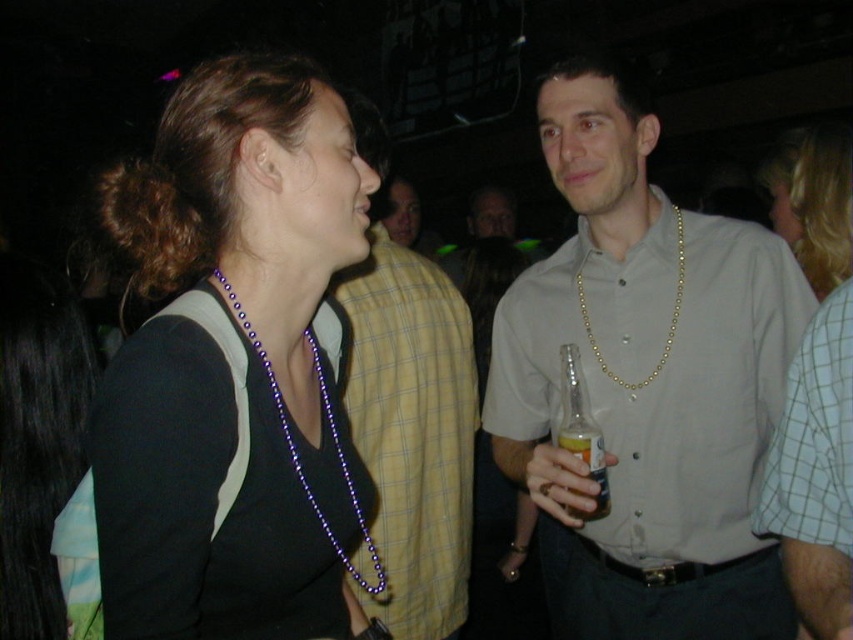
Does blonde hair at upper right have a greater height compared to clear glass bottle at right?

Answer: Yes.

Find the location of a particular element. The width and height of the screenshot is (853, 640). blonde hair at upper right is located at coordinates (811, 200).

Can you confirm if purple beaded necklace at upper left is wider than blonde hair at upper right?

Yes, purple beaded necklace at upper left is wider than blonde hair at upper right.

Who is positioned more to the right, purple beaded necklace at upper left or blonde hair at upper right?

From the viewer's perspective, blonde hair at upper right appears more on the right side.

Which is behind, point (364, 241) or point (798, 246)?

Positioned behind is point (798, 246).

Where is `purple beaded necklace at upper left`? The image size is (853, 640). purple beaded necklace at upper left is located at coordinates (225, 364).

Who is lower down, gold chain necklace at center or yellow plaid shirt at center?

gold chain necklace at center is below.

Consider the image. Is gold chain necklace at center closer to the viewer compared to yellow plaid shirt at center?

That is True.

Which is behind, point (700, 502) or point (422, 472)?

Point (422, 472)

The width and height of the screenshot is (853, 640). What are the coordinates of `gold chain necklace at center` in the screenshot? It's located at (646, 381).